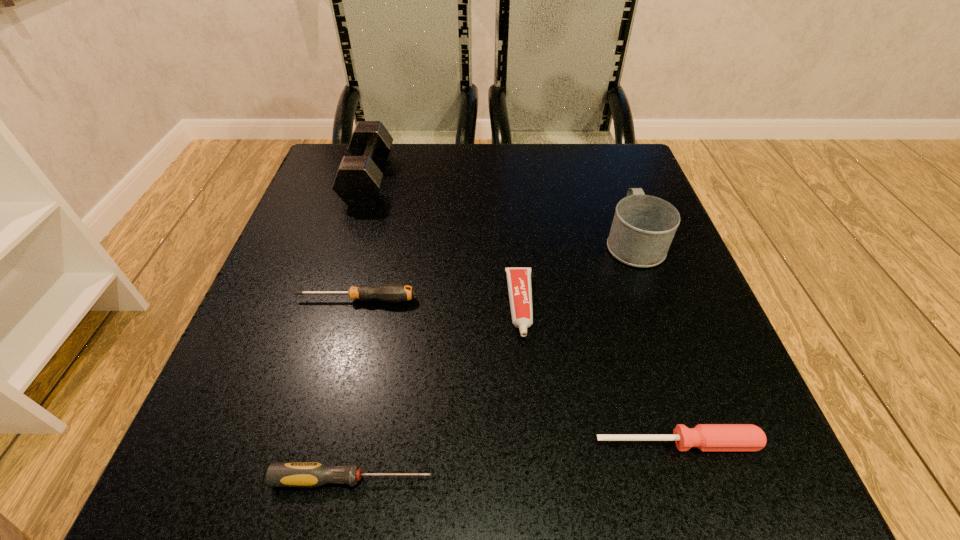
Image resolution: width=960 pixels, height=540 pixels. What are the coordinates of `vacant space situated 0.220m on the side of the second farthest object with the handle` in the screenshot? It's located at (605, 161).

The width and height of the screenshot is (960, 540). Find the location of `vacant area located 0.380m on the right of the farthest screwdriver`. vacant area located 0.380m on the right of the farthest screwdriver is located at coordinates (635, 299).

You are a GUI agent. You are given a task and a screenshot of the screen. Output one action in this format:
    pyautogui.click(x=<x>, y=<y>)
    Task: Click on the free space located on the left of the second nearest screwdriver
    The width and height of the screenshot is (960, 540).
    Given the screenshot: What is the action you would take?
    pyautogui.click(x=297, y=443)

Where is `free space located at the nozzle of the third object from right to left`? The height and width of the screenshot is (540, 960). free space located at the nozzle of the third object from right to left is located at coordinates (535, 476).

The height and width of the screenshot is (540, 960). What are the coordinates of `vacant space located 0.170m insert the nearest screwdriver into a screw head` in the screenshot? It's located at (566, 479).

Where is `object located in the far edge section of the desktop`? object located in the far edge section of the desktop is located at coordinates (358, 180).

Where is `dumbbell present at the left edge`? The height and width of the screenshot is (540, 960). dumbbell present at the left edge is located at coordinates (358, 180).

Where is `mug located in the right edge section of the desktop`? The width and height of the screenshot is (960, 540). mug located in the right edge section of the desktop is located at coordinates (643, 227).

Where is `screwdriver present at the right edge`? Image resolution: width=960 pixels, height=540 pixels. screwdriver present at the right edge is located at coordinates (707, 437).

You are a GUI agent. You are given a task and a screenshot of the screen. Output one action in this format:
    pyautogui.click(x=<x>, y=<y>)
    Task: Click on the object present at the far left corner
    This screenshot has width=960, height=540.
    Given the screenshot: What is the action you would take?
    pyautogui.click(x=358, y=180)